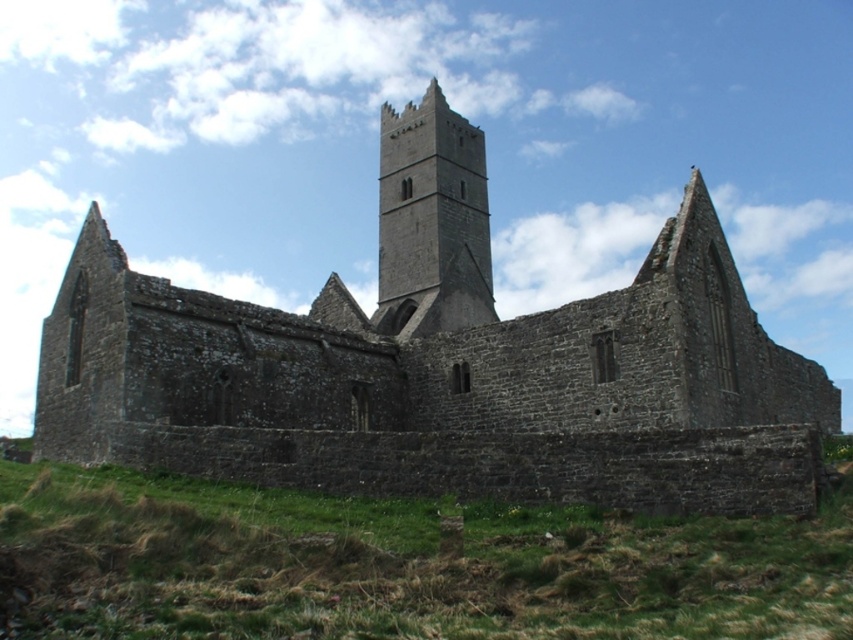
Can you confirm if gray stone church at center is positioned to the right of green grass at lower center?

Indeed, gray stone church at center is positioned on the right side of green grass at lower center.

Measure the distance between gray stone church at center and green grass at lower center.

gray stone church at center and green grass at lower center are 84.01 feet apart from each other.

Is point (492, 456) positioned after point (73, 598)?

Yes, point (492, 456) is farther from viewer.

Where is `gray stone church at center`? The width and height of the screenshot is (853, 640). gray stone church at center is located at coordinates (444, 365).

Who is taller, gray stone church at center or dark gray stone tower at center?

gray stone church at center is taller.

Can you confirm if gray stone church at center is smaller than dark gray stone tower at center?

No, gray stone church at center is not smaller than dark gray stone tower at center.

Is point (82, 449) more distant than point (483, 189)?

No, it is not.

Locate an element on the screen. This screenshot has height=640, width=853. gray stone church at center is located at coordinates (444, 365).

Can you confirm if green grass at lower center is bigger than dark gray stone tower at center?

Actually, green grass at lower center might be smaller than dark gray stone tower at center.

Is green grass at lower center behind dark gray stone tower at center?

No, green grass at lower center is closer to the viewer.

Which is behind, point (666, 620) or point (387, 209)?

The point (387, 209) is behind.

Find the location of a particular element. green grass at lower center is located at coordinates (397, 566).